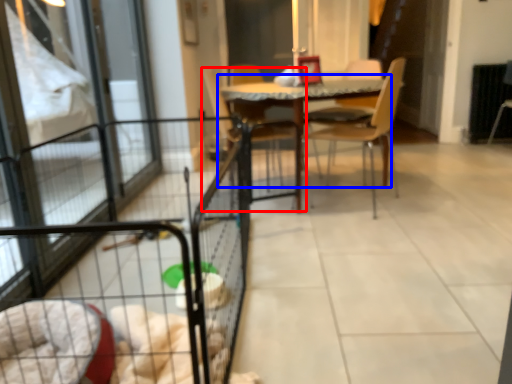
Question: Which of the following is the farthest to the observer, chair (highlighted by a red box) or table (highlighted by a blue box)?

Choices:
 (A) chair
 (B) table

Answer: (A)